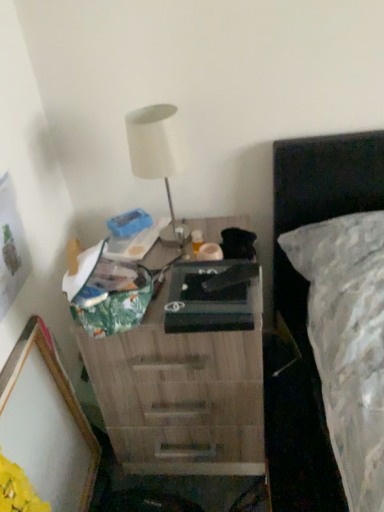
Question: Is wooden nightstand at center facing away from white matte table lamp at upper center?

Choices:
 (A) no
 (B) yes

Answer: (A)

Question: Does wooden nightstand at center contain white matte table lamp at upper center?

Choices:
 (A) yes
 (B) no

Answer: (B)

Question: Is wooden nightstand at center thinner than white matte table lamp at upper center?

Choices:
 (A) no
 (B) yes

Answer: (A)

Question: Is the surface of wooden nightstand at center in direct contact with white matte table lamp at upper center?

Choices:
 (A) yes
 (B) no

Answer: (B)

Question: From the image's perspective, is wooden nightstand at center under white matte table lamp at upper center?

Choices:
 (A) no
 (B) yes

Answer: (B)

Question: Considering the positions of wooden picture frame at lower left and white matte table lamp at upper center in the image, is wooden picture frame at lower left taller or shorter than white matte table lamp at upper center?

Choices:
 (A) tall
 (B) short

Answer: (A)

Question: Relative to white matte table lamp at upper center, is wooden picture frame at lower left in front or behind?

Choices:
 (A) behind
 (B) front

Answer: (B)

Question: Visually, is wooden picture frame at lower left positioned to the left or to the right of white matte table lamp at upper center?

Choices:
 (A) left
 (B) right

Answer: (A)

Question: Considering the positions of point (49, 475) and point (175, 144), is point (49, 475) closer or farther from the camera than point (175, 144)?

Choices:
 (A) closer
 (B) farther

Answer: (B)

Question: From the image's perspective, is wooden picture frame at lower left positioned above or below wooden nightstand at center?

Choices:
 (A) above
 (B) below

Answer: (B)

Question: Looking at the image, does wooden picture frame at lower left seem bigger or smaller compared to wooden nightstand at center?

Choices:
 (A) small
 (B) big

Answer: (A)

Question: Is wooden picture frame at lower left wider or thinner than wooden nightstand at center?

Choices:
 (A) wide
 (B) thin

Answer: (B)

Question: Relative to wooden nightstand at center, is wooden picture frame at lower left in front or behind?

Choices:
 (A) behind
 (B) front

Answer: (B)

Question: Is white matte table lamp at upper center spatially inside wooden nightstand at center, or outside of it?

Choices:
 (A) inside
 (B) outside

Answer: (B)

Question: Looking at the image, does white matte table lamp at upper center seem bigger or smaller compared to wooden nightstand at center?

Choices:
 (A) small
 (B) big

Answer: (A)